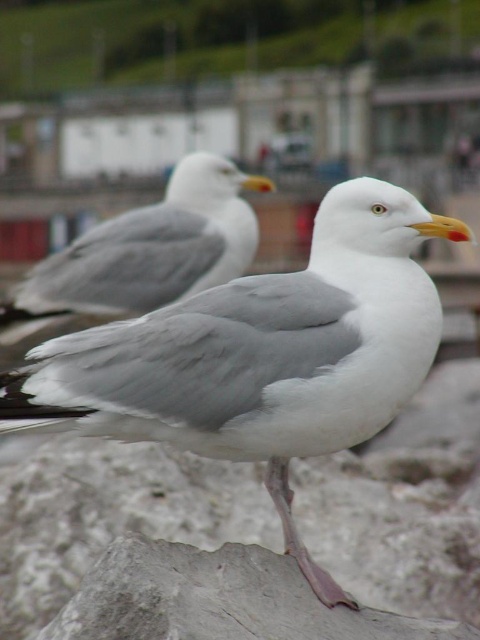
You are a photographer trying to capture a clear shot of both seagulls. You notice two points of interest marked as point [420,346] and point [133,241]. Based on their positions, which point is closer to your camera lens?

Point [420,346] is closer to the camera lens than point [133,241].

You are a photographer trying to capture both birds in focus. Based on their positions, which one should you adjust your camera focus to prioritize to ensure the white feathered bird at center and the white feathered seagull at center are both in focus?

To ensure both the white feathered bird at center and the white feathered seagull at center are in focus, you should adjust your camera focus to prioritize the white feathered seagull at center since it is farther away. By focusing on the farther bird, the closer one might still be within the depth of field range, increasing the chances of both being sharp.

You are standing at the camera position and want to throw a small pebble to hit the point at coordinates point (135, 368). If your maximum throwing distance is 3 meters, will you be able to reach it?

The point (135, 368) is 2.97 meters from the camera, so yes, you can reach it with your maximum throwing distance of 3 meters.